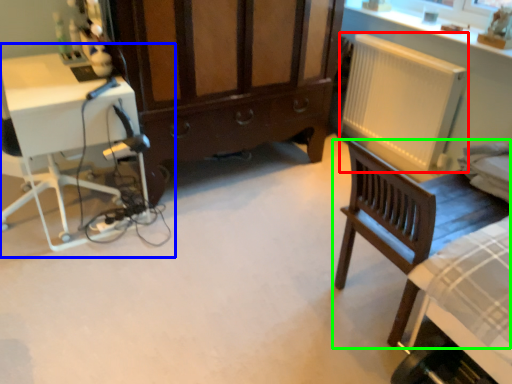
Question: Considering the real-world distances, which object is farthest from radiator (highlighted by a red box)? computer desk (highlighted by a blue box) or chair (highlighted by a green box)?

Choices:
 (A) computer desk
 (B) chair

Answer: (A)